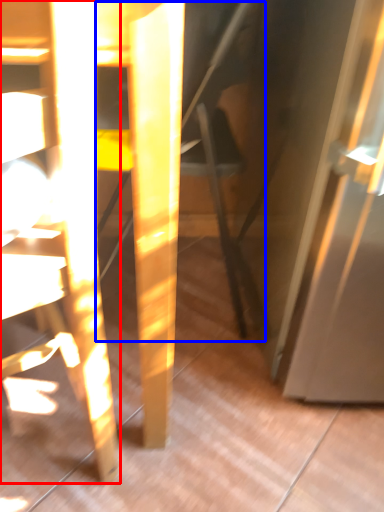
Question: Which object is further to the camera taking this photo, chair (highlighted by a red box) or swivel chair (highlighted by a blue box)?

Choices:
 (A) chair
 (B) swivel chair

Answer: (B)